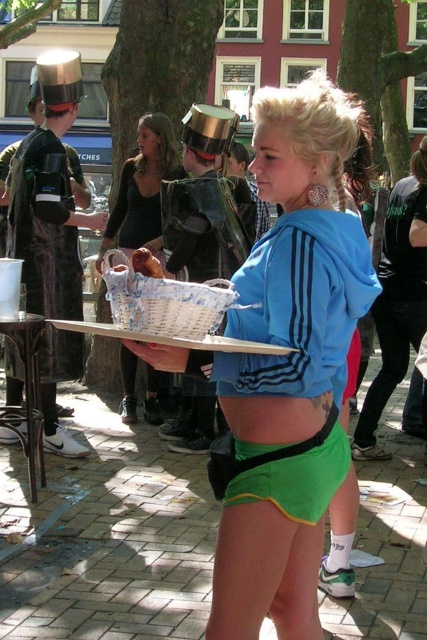
You are standing at the center of the plaza and see the point marked at coordinates (x=143, y=188). What object is located at that point?

The point at coordinates (x=143, y=188) marks the location of the matte black basket at center.

You are a photographer trying to capture both the matte blue hoodie at center and the brushed metal hat at upper left in a single shot. Which object should you adjust your camera angle to focus on first to ensure both are in frame?

The matte blue hoodie at center is positioned over the brushed metal hat at upper left, so you should focus on the matte blue hoodie at center first to ensure both are visible in the frame.